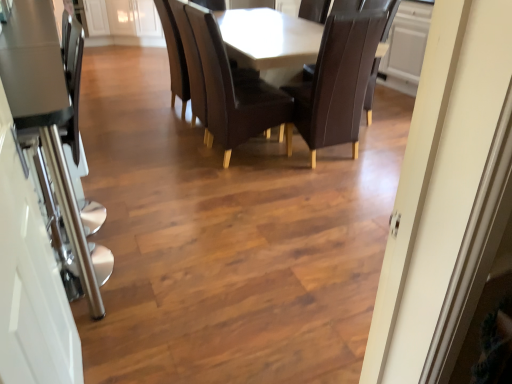
Question: Can you see leather at center, which is counted as the second chair, starting from the right, touching clear glass door at left?

Choices:
 (A) yes
 (B) no

Answer: (B)

Question: Is leather at center, which is counted as the second chair, starting from the right, positioned before clear glass door at left?

Choices:
 (A) no
 (B) yes

Answer: (A)

Question: Considering the relative positions of leather at center, the first chair positioned from the left, and clear glass door at left in the image provided, is leather at center, the first chair positioned from the left, to the left of clear glass door at left from the viewer's perspective?

Choices:
 (A) no
 (B) yes

Answer: (A)

Question: Is leather at center, which is counted as the second chair, starting from the right, smaller than clear glass door at left?

Choices:
 (A) yes
 (B) no

Answer: (B)

Question: From a real-world perspective, is leather at center, the first chair positioned from the left, physically below clear glass door at left?

Choices:
 (A) no
 (B) yes

Answer: (B)

Question: Does leather at center, which is counted as the second chair, starting from the right, turn towards clear glass door at left?

Choices:
 (A) no
 (B) yes

Answer: (A)

Question: Would you say clear glass door at left is a long distance from leather at center, which is counted as the second chair, starting from the right?

Choices:
 (A) no
 (B) yes

Answer: (B)

Question: Is clear glass door at left beside leather at center, the first chair positioned from the left?

Choices:
 (A) yes
 (B) no

Answer: (B)

Question: Is clear glass door at left wider than leather at center, which is counted as the second chair, starting from the right?

Choices:
 (A) no
 (B) yes

Answer: (A)

Question: Considering the relative positions of clear glass door at left and leather at center, the first chair positioned from the left, in the image provided, is clear glass door at left to the left of leather at center, the first chair positioned from the left, from the viewer's perspective?

Choices:
 (A) no
 (B) yes

Answer: (B)

Question: Does clear glass door at left have a lesser height compared to leather at center, the first chair positioned from the left?

Choices:
 (A) yes
 (B) no

Answer: (B)

Question: Can you confirm if clear glass door at left is thinner than leather at center, which is counted as the second chair, starting from the right?

Choices:
 (A) no
 (B) yes

Answer: (B)

Question: Is leather at center, which is counted as the second chair, starting from the right, thinner than dark brown leather chair at center, which ranks as the second chair in left-to-right order?

Choices:
 (A) yes
 (B) no

Answer: (B)